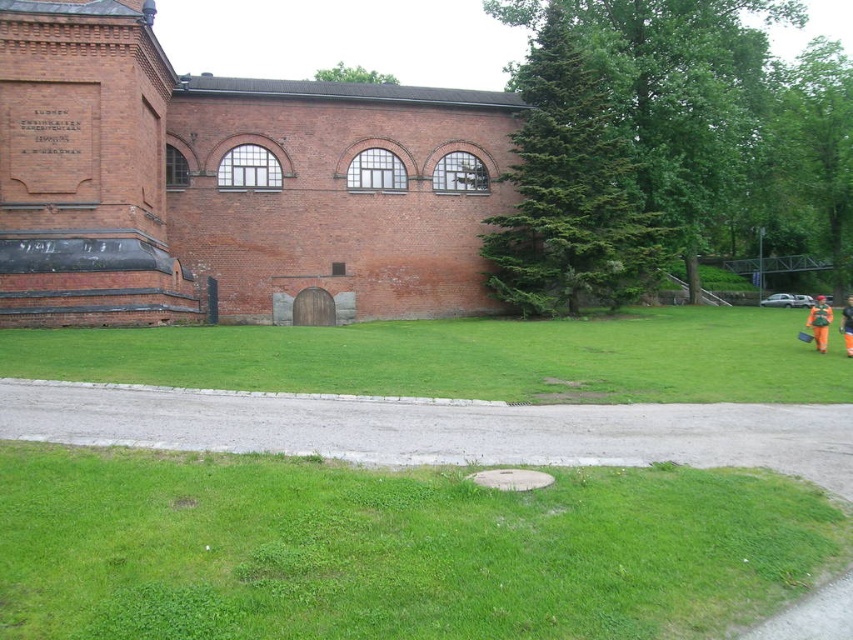
Question: Is orange reflective vest at lower right above orange reflective suit at right?

Choices:
 (A) no
 (B) yes

Answer: (B)

Question: Does green grass at lower center have a larger size compared to orange reflective vest at lower right?

Choices:
 (A) yes
 (B) no

Answer: (B)

Question: Does green grass at lower center have a lesser width compared to orange reflective suit at right?

Choices:
 (A) no
 (B) yes

Answer: (B)

Question: Estimate the real-world distances between objects in this image. Which object is closer to the orange reflective vest at lower right?

Choices:
 (A) orange reflective suit at right
 (B) green grass at lower center

Answer: (A)

Question: Which object is the closest to the orange reflective vest at lower right?

Choices:
 (A) green grass at lower center
 (B) orange reflective suit at right

Answer: (B)

Question: Which object is the closest to the orange reflective suit at right?

Choices:
 (A) green grass at lower center
 (B) orange reflective vest at lower right

Answer: (B)